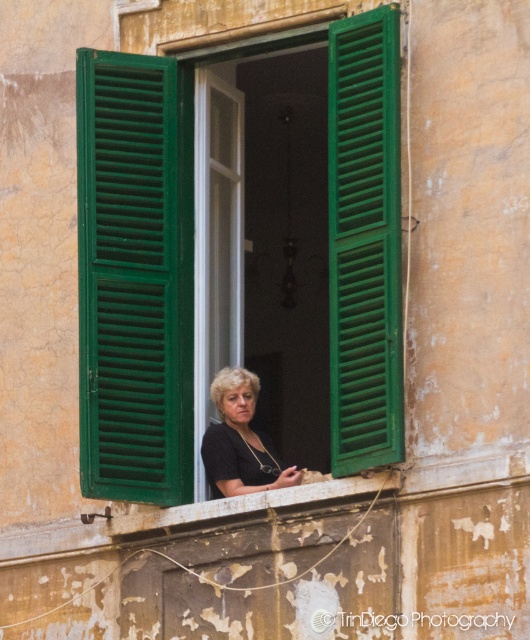
Who is higher up, green matte shutters at center or black matte shirt at center?

green matte shutters at center is higher up.

Measure the distance between green matte shutters at center and camera.

62.07 meters

At what (x,y) coordinates should I click in order to perform the action: click on green matte shutters at center. Please return your answer as a coordinate pair (x, y). Looking at the image, I should click on (134, 276).

Can you confirm if green wooden shutters at center is positioned below green painted wood shutter at center?

No.

The height and width of the screenshot is (640, 530). Identify the location of green wooden shutters at center. (135, 275).

Image resolution: width=530 pixels, height=640 pixels. Describe the element at coordinates (135, 275) in the screenshot. I see `green wooden shutters at center` at that location.

The width and height of the screenshot is (530, 640). I want to click on green wooden shutters at center, so pyautogui.click(x=135, y=275).

Who is positioned more to the left, green wooden shutters at center or green matte shutters at center?

green matte shutters at center

Can you confirm if green wooden shutters at center is bigger than green matte shutters at center?

Correct, green wooden shutters at center is larger in size than green matte shutters at center.

Is point (156, 161) more distant than point (100, 70)?

Yes, it is behind point (100, 70).

The image size is (530, 640). Identify the location of green wooden shutters at center. (135, 275).